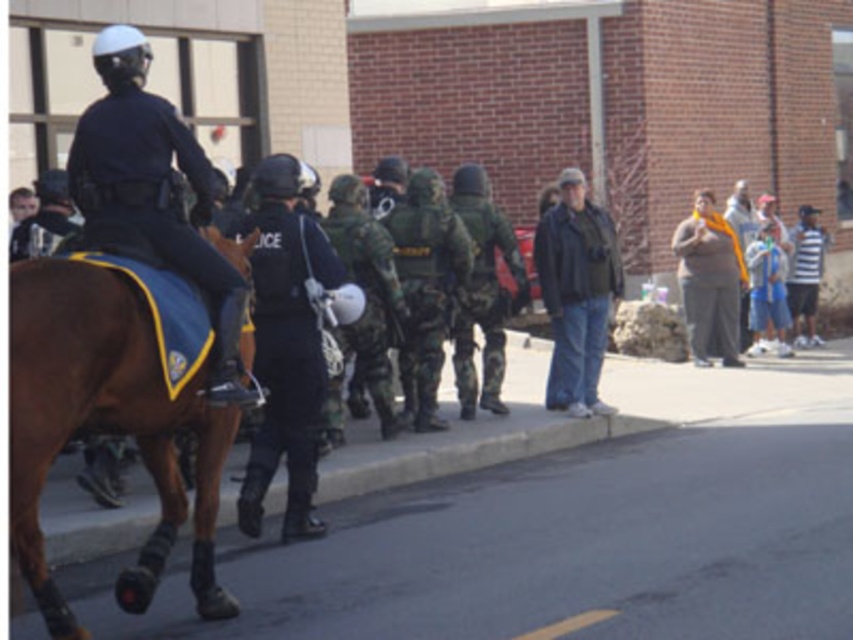
Does point (106, 378) lie behind point (111, 45)?

That is False.

Is brown leather saddle at left thinner than dark blue uniform at left?

Yes.

Who is more forward, (x=35, y=525) or (x=144, y=93)?

Positioned in front is point (x=35, y=525).

At what (x,y) coordinates should I click in order to perform the action: click on brown leather saddle at left. Please return your answer as a coordinate pair (x, y). The width and height of the screenshot is (853, 640). Looking at the image, I should click on (103, 419).

Is brown leather saddle at left positioned in front of dark blue uniform at center?

Yes, brown leather saddle at left is closer to the viewer.

In the scene shown: Does brown leather saddle at left have a lesser height compared to dark blue uniform at center?

Correct, brown leather saddle at left is not as tall as dark blue uniform at center.

Who is more forward, (137, 378) or (270, 227)?

Point (137, 378) is in front.

Identify the location of brown leather saddle at left. The height and width of the screenshot is (640, 853). (103, 419).

Does dark blue uniform at left appear over dark blue uniform at center?

Indeed, dark blue uniform at left is positioned over dark blue uniform at center.

Is dark blue uniform at left further to the viewer compared to dark blue uniform at center?

No, it is in front of dark blue uniform at center.

Who is more forward, (227, 332) or (251, 452)?

Point (227, 332) is more forward.

I want to click on dark blue uniform at left, so click(x=155, y=189).